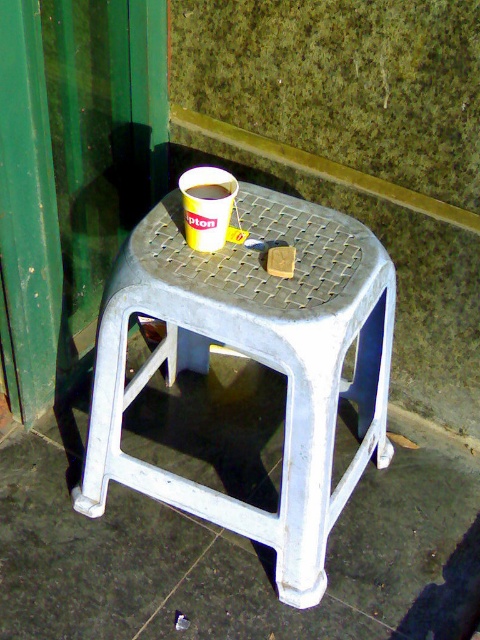
Can you confirm if yellow paper cup at center is smaller than matte yellow cup at center?

Actually, yellow paper cup at center might be larger than matte yellow cup at center.

Looking at this image, does yellow paper cup at center have a lesser width compared to matte yellow cup at center?

No.

Between point (199, 227) and point (192, 195), which one is positioned behind?

Positioned behind is point (192, 195).

Identify the location of yellow paper cup at center. (206, 205).

Can you confirm if white plastic stool at center is positioned to the right of matte yellow cup at center?

Correct, you'll find white plastic stool at center to the right of matte yellow cup at center.

Where is `white plastic stool at center`? The height and width of the screenshot is (640, 480). white plastic stool at center is located at coordinates (253, 358).

Does white plastic stool at center have a larger size compared to yellow paper cup at center?

Indeed, white plastic stool at center has a larger size compared to yellow paper cup at center.

Between point (280, 484) and point (194, 173), which one is positioned behind?

Point (280, 484)

The image size is (480, 640). Describe the element at coordinates (253, 358) in the screenshot. I see `white plastic stool at center` at that location.

Locate an element on the screen. This screenshot has width=480, height=640. white plastic stool at center is located at coordinates tap(253, 358).